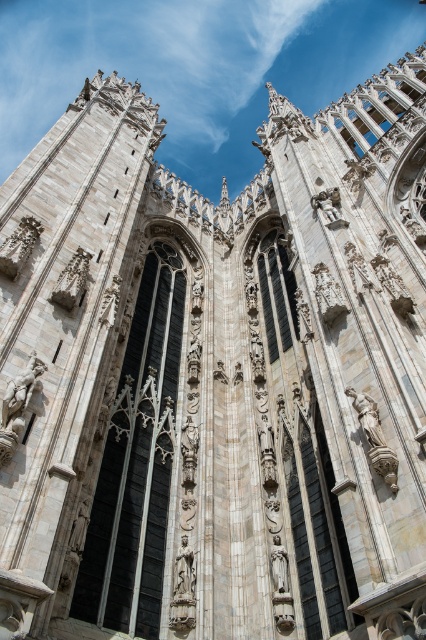
Question: Which point is closer to the camera taking this photo?

Choices:
 (A) (26, 401)
 (B) (287, 582)
 (C) (377, 406)
 (D) (327, 196)

Answer: (A)

Question: Can you confirm if polished stone statue at center is smaller than white marble statue at center-right?

Choices:
 (A) yes
 (B) no

Answer: (B)

Question: Which of the following is the farthest from the observer?

Choices:
 (A) polished stone statue at center
 (B) white marble statue at center

Answer: (A)

Question: Does white marble statue at center have a lesser width compared to white marble statue at center-right?

Choices:
 (A) no
 (B) yes

Answer: (A)

Question: Can you confirm if white marble statue at center is smaller than polished stone statue at center?

Choices:
 (A) no
 (B) yes

Answer: (A)

Question: Which object is positioned closest to the white marble statue at center?

Choices:
 (A) white marble statue at center-right
 (B) matte stone statue at center
 (C) polished stone statue at upper center

Answer: (B)